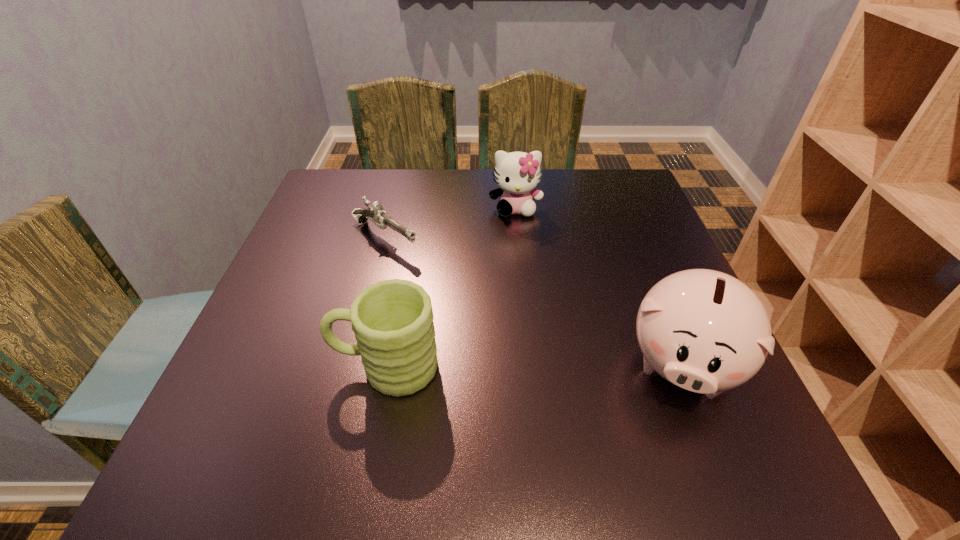
This screenshot has height=540, width=960. I want to click on vacant space at the near edge of the desktop, so click(x=597, y=420).

In the image, there is a desktop. Identify the location of vacant area at the left edge. The image size is (960, 540). (364, 230).

I want to click on blank space at the right edge of the desktop, so click(x=625, y=287).

I want to click on free space at the far left corner of the desktop, so click(355, 204).

This screenshot has width=960, height=540. In the image, there is a desktop. Identify the location of blank space at the near left corner. (251, 417).

Identify the location of vacant space at the far right corner of the desktop. (635, 176).

Locate an element on the screen. Image resolution: width=960 pixels, height=540 pixels. free space between the kitten and the shortest object is located at coordinates (450, 223).

Find the location of a particular element. empty location between the mug and the tallest object is located at coordinates point(534,366).

This screenshot has width=960, height=540. What are the coordinates of `vacant area between the mug and the second object from right to left` in the screenshot? It's located at (451, 287).

The height and width of the screenshot is (540, 960). What are the coordinates of `blank region between the mug and the piggy bank` in the screenshot? It's located at (534, 366).